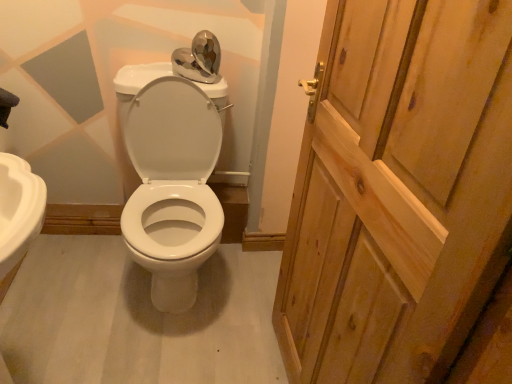
Where is `white glossy toilet at center`? The height and width of the screenshot is (384, 512). white glossy toilet at center is located at coordinates (170, 178).

The height and width of the screenshot is (384, 512). Describe the element at coordinates (170, 178) in the screenshot. I see `white glossy toilet at center` at that location.

The width and height of the screenshot is (512, 384). Describe the element at coordinates (398, 191) in the screenshot. I see `wooden door at right` at that location.

Find the location of a particular element. The image size is (512, 384). wooden door at right is located at coordinates pos(398,191).

What is the approximate width of wooden door at right?

wooden door at right is 3.77 inches wide.

Identify the location of white glossy toilet at center. (170, 178).

Considering the relative positions of wooden door at right and white glossy toilet at center in the image provided, is wooden door at right to the left or to the right of white glossy toilet at center?

In the image, wooden door at right appears on the right side of white glossy toilet at center.

Is wooden door at right in front of or behind white glossy toilet at center in the image?

In the image, wooden door at right appears in front of white glossy toilet at center.

Which is in front, point (359, 110) or point (177, 305)?

Point (359, 110)

From the image's perspective, which one is positioned higher, wooden door at right or white glossy toilet at center?

white glossy toilet at center, from the image's perspective.

From a real-world perspective, relative to white glossy toilet at center, is wooden door at right vertically above or below?

wooden door at right is above white glossy toilet at center.

Does wooden door at right have a lesser width compared to white glossy toilet at center?

Yes, wooden door at right is thinner than white glossy toilet at center.

Can you confirm if wooden door at right is taller than white glossy toilet at center?

Yes.

Who is bigger, wooden door at right or white glossy toilet at center?

With larger size is white glossy toilet at center.

Is wooden door at right spatially inside white glossy toilet at center, or outside of it?

wooden door at right exists outside the volume of white glossy toilet at center.

Is wooden door at right directly adjacent to white glossy toilet at center?

wooden door at right and white glossy toilet at center are clearly separated.

Does wooden door at right turn towards white glossy toilet at center?

No, wooden door at right is not oriented towards white glossy toilet at center.

How far apart are wooden door at right and white glossy toilet at center?

28.10 inches.

At what (x,y) coordinates should I click in order to perform the action: click on door that is on the right side of white glossy toilet at center. Please return your answer as a coordinate pair (x, y). The image size is (512, 384). Looking at the image, I should click on (398, 191).

Consider the image. Can you confirm if white glossy toilet at center is positioned to the left of wooden door at right?

Indeed, white glossy toilet at center is positioned on the left side of wooden door at right.

Is white glossy toilet at center closer to the viewer compared to wooden door at right?

That is False.

Is point (131, 199) positioned in front of point (345, 354)?

No.

Consider the image. From the image's perspective, between white glossy toilet at center and wooden door at right, which one is located above?

white glossy toilet at center.

From the picture: From a real-world perspective, is white glossy toilet at center over wooden door at right?

No.

Is white glossy toilet at center thinner than wooden door at right?

In fact, white glossy toilet at center might be wider than wooden door at right.

Is white glossy toilet at center shorter than wooden door at right?

Yes.

Considering the relative sizes of white glossy toilet at center and wooden door at right in the image provided, is white glossy toilet at center bigger than wooden door at right?

Yes, white glossy toilet at center is bigger than wooden door at right.

Is white glossy toilet at center outside of wooden door at right?

That's correct, white glossy toilet at center is outside of wooden door at right.

Is white glossy toilet at center directly adjacent to wooden door at right?

white glossy toilet at center is not next to wooden door at right, and they're not touching.

Looking at this image, could you tell me if white glossy toilet at center is turned towards wooden door at right?

No, white glossy toilet at center is not oriented towards wooden door at right.

You are a GUI agent. You are given a task and a screenshot of the screen. Output one action in this format:
    pyautogui.click(x=<x>, y=<y>)
    Task: Click on the porcelain lying on the left of wooden door at right
    The image size is (512, 384).
    Given the screenshot: What is the action you would take?
    coord(170,178)

The height and width of the screenshot is (384, 512). What are the coordinates of `porcelain located underneath the wooden door at right (from a real-world perspective)` in the screenshot? It's located at (170, 178).

This screenshot has width=512, height=384. I want to click on porcelain above the wooden door at right (from the image's perspective), so click(x=170, y=178).